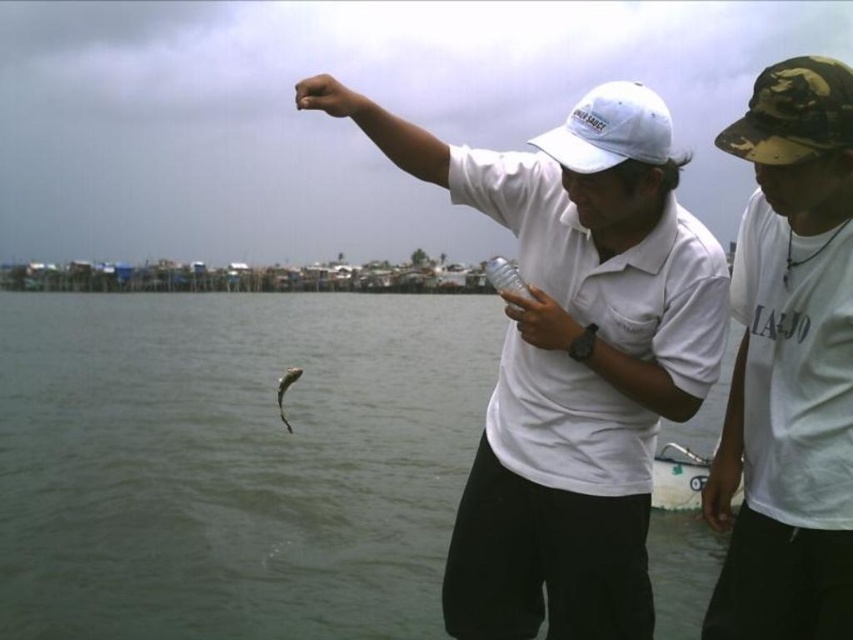
Does white matte baseball cap at center appear on the left side of shiny silver fish at center?

No, white matte baseball cap at center is not to the left of shiny silver fish at center.

The image size is (853, 640). What do you see at coordinates (610, 129) in the screenshot? I see `white matte baseball cap at center` at bounding box center [610, 129].

The image size is (853, 640). In order to click on white matte baseball cap at center in this screenshot , I will do `click(610, 129)`.

Between point (769, 600) and point (294, 372), which one is positioned in front?

Point (769, 600)

The image size is (853, 640). Find the location of `camouflage fabric cap at upper right`. camouflage fabric cap at upper right is located at coordinates (788, 365).

Does point (497, 259) come in front of point (281, 376)?

Yes, it is.

Does point (502, 257) come farther from viewer compared to point (288, 378)?

No.

You are a GUI agent. You are given a task and a screenshot of the screen. Output one action in this format:
    pyautogui.click(x=<x>, y=<y>)
    Task: Click on the clear plastic bottle at center
    The width and height of the screenshot is (853, 640).
    Given the screenshot: What is the action you would take?
    pyautogui.click(x=505, y=276)

I want to click on clear plastic bottle at center, so click(505, 276).